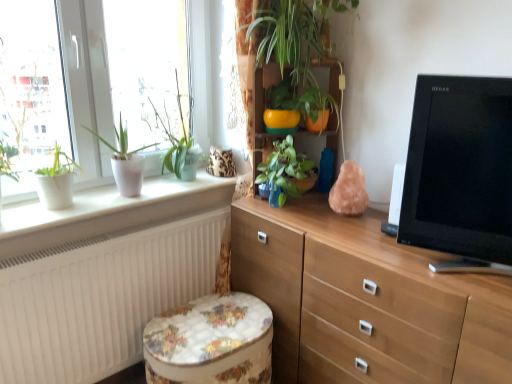
What are the coordinates of `vacant area that lies between black glossy tv at right and green glossy plant at center, the 3th houseplant positioned from the left` in the screenshot? It's located at (346, 237).